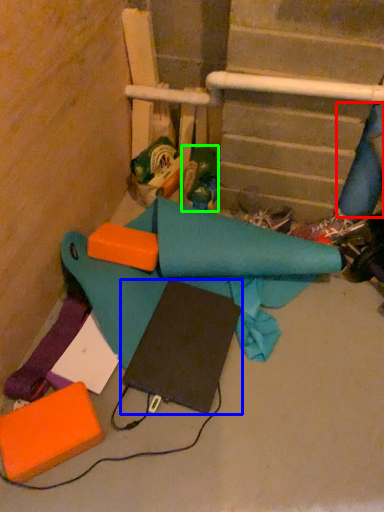
Question: Based on their relative distances, which object is farther from fabric (highlighted by a red box)? Choose from notebook (highlighted by a blue box) and toy (highlighted by a green box).

Choices:
 (A) notebook
 (B) toy

Answer: (A)